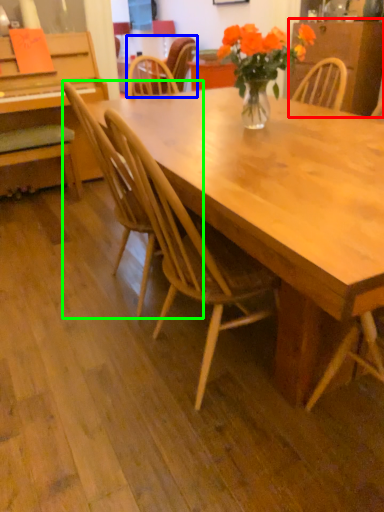
Question: Which is farther away from dresser (highlighted by a red box)? chair (highlighted by a blue box) or chair (highlighted by a green box)?

Choices:
 (A) chair
 (B) chair

Answer: (B)